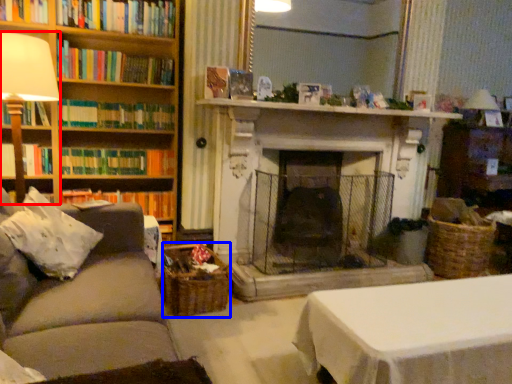
Question: Among these objects, which one is nearest to the camera, table lamp (highlighted by a red box) or basket (highlighted by a blue box)?

Choices:
 (A) table lamp
 (B) basket

Answer: (A)